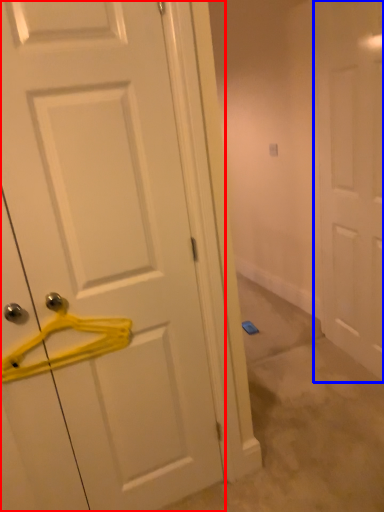
Question: Which object appears farthest to the camera in this image, door (highlighted by a red box) or door (highlighted by a blue box)?

Choices:
 (A) door
 (B) door

Answer: (B)